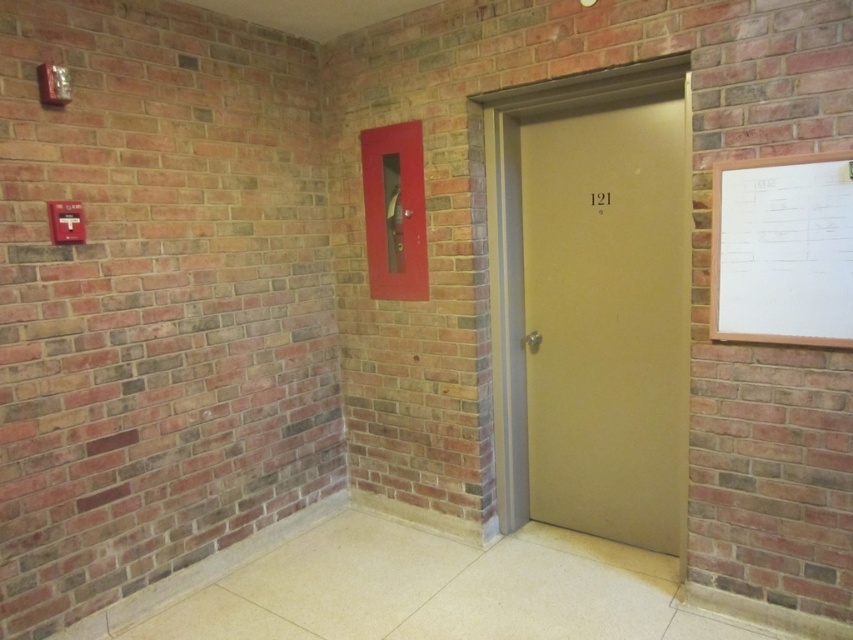
Is white wooden board at upper right taller than metallic red fire extinguisher at center?

In fact, white wooden board at upper right may be shorter than metallic red fire extinguisher at center.

In the scene shown: Is white wooden board at upper right further to camera compared to metallic red fire extinguisher at center?

No, it is not.

What do you see at coordinates (782, 250) in the screenshot? I see `white wooden board at upper right` at bounding box center [782, 250].

Where is `white wooden board at upper right`? The image size is (853, 640). white wooden board at upper right is located at coordinates point(782,250).

Is point (660, 163) closer to viewer compared to point (373, 145)?

Yes, it is.

Is point (563, 246) positioned after point (384, 288)?

No.

Locate an element on the screen. The image size is (853, 640). matte beige door at center is located at coordinates (596, 314).

Which is above, matte beige door at center or white wooden board at upper right?

white wooden board at upper right

I want to click on matte beige door at center, so click(x=596, y=314).